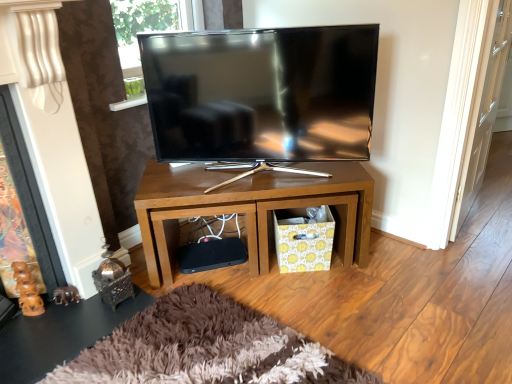
You are a GUI agent. You are given a task and a screenshot of the screen. Output one action in this format:
    pyautogui.click(x=<x>, y=<y>)
    Task: Click on the vacant area to the left of yellow floral cardboard crate at lower center
    Image resolution: width=512 pixels, height=384 pixels.
    Given the screenshot: What is the action you would take?
    pyautogui.click(x=254, y=281)